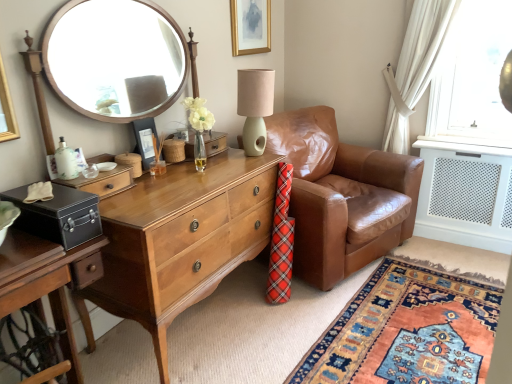
Question: Considering their positions, is matte black safe at left located in front of or behind light brown wood desk at center?

Choices:
 (A) behind
 (B) front

Answer: (B)

Question: In the image, is matte black safe at left on the left side or the right side of light brown wood desk at center?

Choices:
 (A) right
 (B) left

Answer: (B)

Question: Estimate the real-world distances between objects in this image. Which object is farther from the matte gold picture frame at upper center, positioned as the first picture frame in top-to-bottom order?

Choices:
 (A) white glossy bottle at left
 (B) light brown wood desk at center
 (C) matte black safe at left
 (D) carpet with intricate patterns at lower right
 (E) black matte picture frame at center, arranged as the 1th picture frame when viewed from the front

Answer: (D)

Question: Estimate the real-world distances between objects in this image. Which object is farther from the matte gold picture frame at upper center, which is the second picture frame from left to right?

Choices:
 (A) light brown wood desk at center
 (B) matte black safe at left
 (C) matte brown drawer at center
 (D) carpet with intricate patterns at lower right
 (E) black matte picture frame at center, positioned as the first picture frame in left-to-right order

Answer: (D)